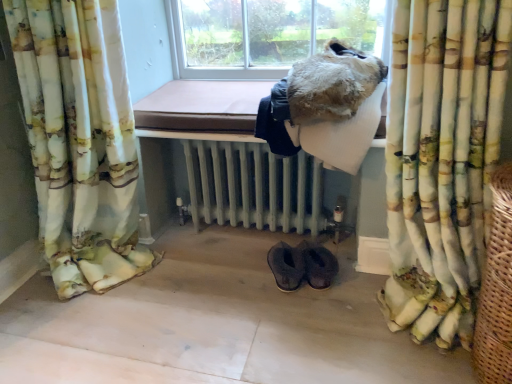
Question: Is woven brown basket at right located outside brown suede slippers at lower center?

Choices:
 (A) yes
 (B) no

Answer: (A)

Question: Can you confirm if woven brown basket at right is positioned to the left of brown suede slippers at lower center?

Choices:
 (A) no
 (B) yes

Answer: (A)

Question: Is brown suede slippers at lower center a part of woven brown basket at right?

Choices:
 (A) yes
 (B) no

Answer: (B)

Question: Considering the relative sizes of woven brown basket at right and brown suede slippers at lower center in the image provided, is woven brown basket at right bigger than brown suede slippers at lower center?

Choices:
 (A) yes
 (B) no

Answer: (A)

Question: Is woven brown basket at right thinner than brown suede slippers at lower center?

Choices:
 (A) no
 (B) yes

Answer: (A)

Question: Is woven brown basket at right positioned far away from brown suede slippers at lower center?

Choices:
 (A) yes
 (B) no

Answer: (B)

Question: Is woven brown basket at right beside fuzzy fur coat at upper center?

Choices:
 (A) no
 (B) yes

Answer: (A)

Question: From the image's perspective, is woven brown basket at right on top of fuzzy fur coat at upper center?

Choices:
 (A) no
 (B) yes

Answer: (A)

Question: Does woven brown basket at right appear on the right side of fuzzy fur coat at upper center?

Choices:
 (A) no
 (B) yes

Answer: (B)

Question: Can you confirm if woven brown basket at right is taller than fuzzy fur coat at upper center?

Choices:
 (A) no
 (B) yes

Answer: (B)

Question: Is woven brown basket at right positioned with its back to fuzzy fur coat at upper center?

Choices:
 (A) no
 (B) yes

Answer: (A)

Question: Is woven brown basket at right thinner than fuzzy fur coat at upper center?

Choices:
 (A) no
 (B) yes

Answer: (A)

Question: Is white painted radiator at center at the right side of brown suede slippers at lower center?

Choices:
 (A) yes
 (B) no

Answer: (B)